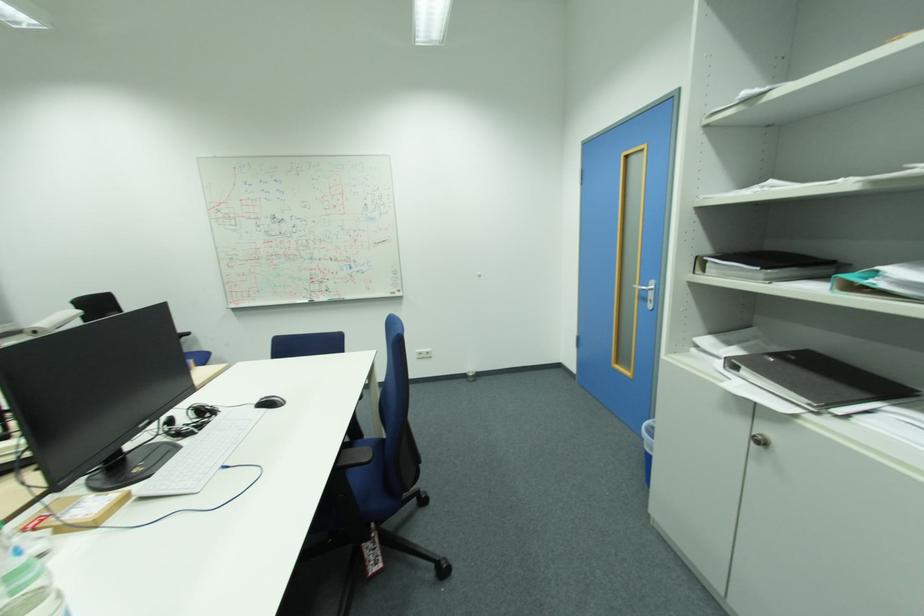
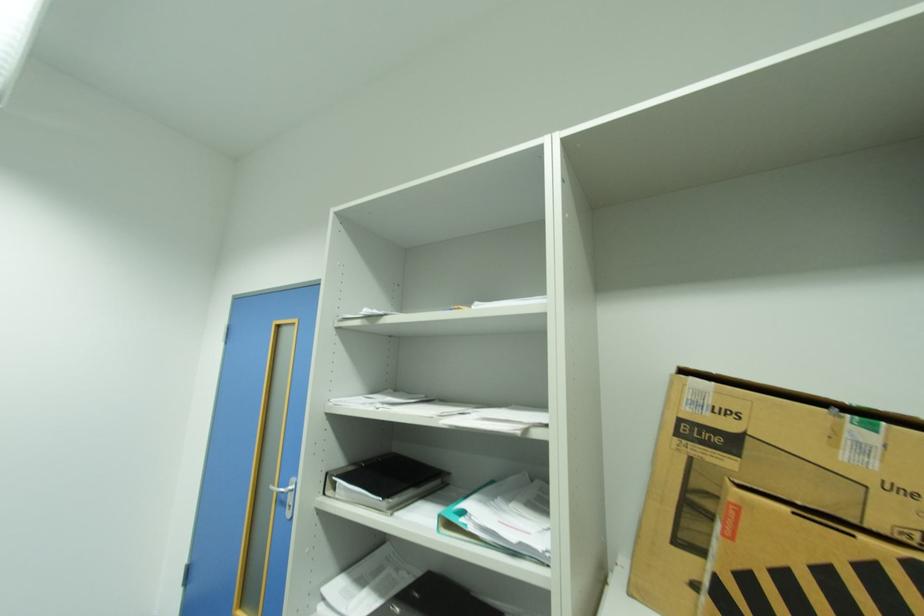
Locate, in the second image, the point that corresponds to point 714,265 in the first image.

(344, 485)